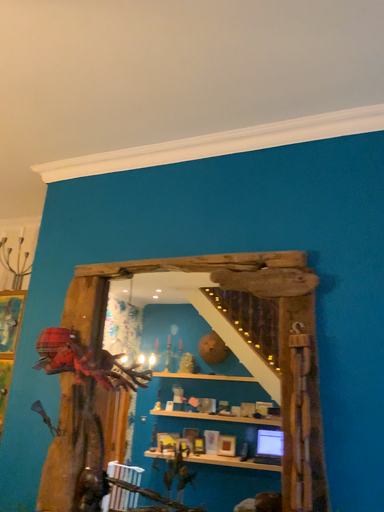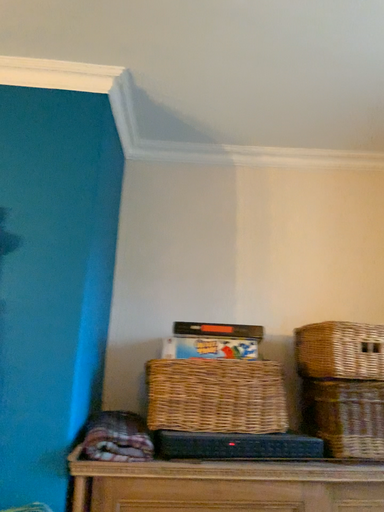
Question: How did the camera likely rotate when shooting the video?

Choices:
 (A) rotated upward
 (B) rotated downward

Answer: (B)